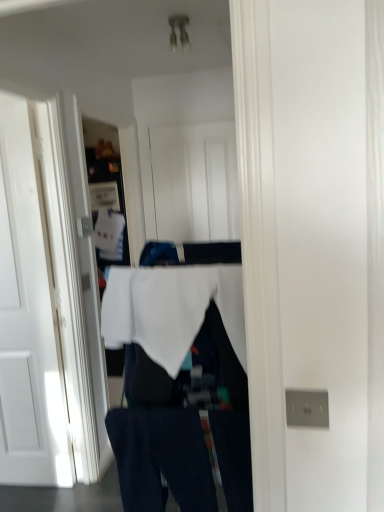
Question: Is the depth of white matte door at left, marked as the second door in a back-to-front arrangement, less than that of white fabric at center?

Choices:
 (A) yes
 (B) no

Answer: (B)

Question: Is white matte door at left, the first door positioned from the left, taller than white fabric at center?

Choices:
 (A) yes
 (B) no

Answer: (A)

Question: Is white matte door at left, which is counted as the 2th door, starting from the right, in contact with white fabric at center?

Choices:
 (A) no
 (B) yes

Answer: (A)

Question: From a real-world perspective, does white matte door at left, marked as the second door in a back-to-front arrangement, sit lower than white fabric at center?

Choices:
 (A) yes
 (B) no

Answer: (A)

Question: Is white matte door at left, which is the 1th door in front-to-back order, thinner than white fabric at center?

Choices:
 (A) yes
 (B) no

Answer: (A)

Question: In terms of size, does dark blue denim jeans at lower center appear bigger or smaller than white fabric at center?

Choices:
 (A) big
 (B) small

Answer: (B)

Question: Would you say dark blue denim jeans at lower center is inside or outside white fabric at center?

Choices:
 (A) outside
 (B) inside

Answer: (A)

Question: Visually, is dark blue denim jeans at lower center positioned to the left or to the right of white fabric at center?

Choices:
 (A) left
 (B) right

Answer: (A)

Question: Considering the positions of dark blue denim jeans at lower center and white fabric at center in the image, is dark blue denim jeans at lower center wider or thinner than white fabric at center?

Choices:
 (A) wide
 (B) thin

Answer: (B)

Question: Is point (16, 117) positioned closer to the camera than point (152, 312)?

Choices:
 (A) closer
 (B) farther

Answer: (B)

Question: Is white matte door at left, marked as the second door in a back-to-front arrangement, inside or outside of white fabric at center?

Choices:
 (A) inside
 (B) outside

Answer: (B)

Question: From a real-world perspective, is white matte door at left, which is the 1th door in front-to-back order, positioned above or below white fabric at center?

Choices:
 (A) below
 (B) above

Answer: (A)

Question: Is white matte door at left, which is counted as the 2th door, starting from the right, bigger or smaller than white fabric at center?

Choices:
 (A) small
 (B) big

Answer: (B)

Question: Based on their positions, is dark blue denim jeans at lower center located to the left or right of white wood door at center, which ranks as the first door in back-to-front order?

Choices:
 (A) left
 (B) right

Answer: (A)

Question: In terms of width, does dark blue denim jeans at lower center look wider or thinner when compared to white wood door at center, which appears as the second door when viewed from the front?

Choices:
 (A) wide
 (B) thin

Answer: (A)